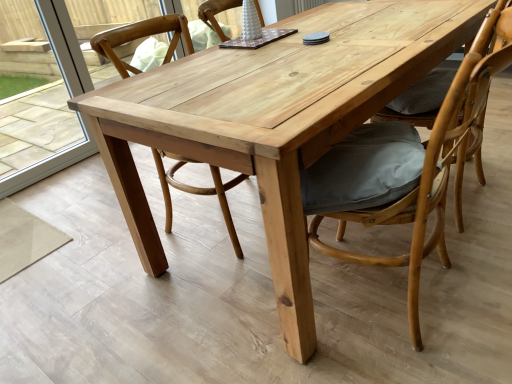
The image size is (512, 384). I want to click on free point in front of natural wood chair at center, which is counted as the 1th chair, starting from the left, so click(x=193, y=289).